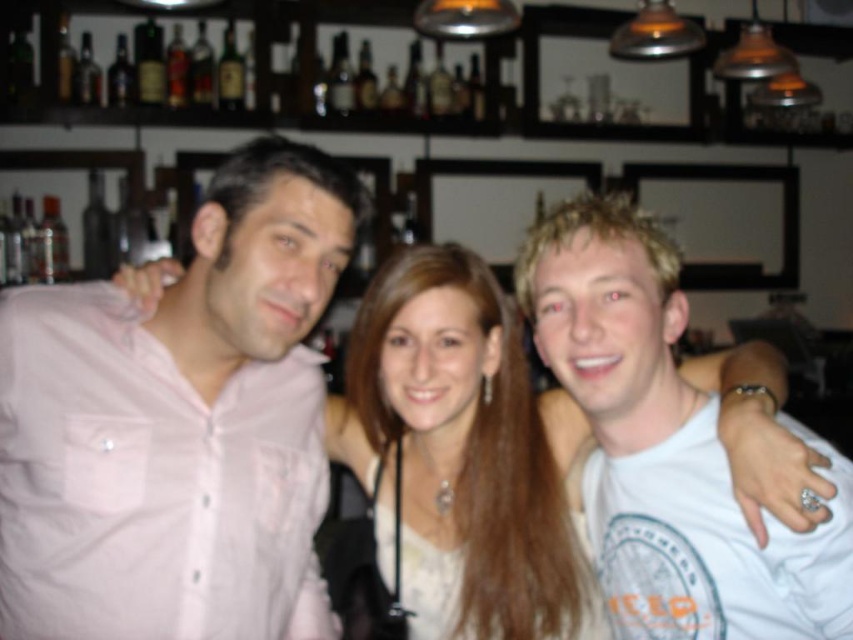
You are a photographer trying to capture a candid shot of the three people in the bar scene. You notice a white cotton t shirt at center located at point [666,445]. If you want to focus on the person wearing the white cotton t shirt at center, which direction should you move your camera to ensure they are centered in your viewfinder?

The white cotton t shirt at center is already at the center point [666,445], so no adjustment is needed. The camera should already have the person wearing the white cotton t shirt at center in the center of the viewfinder.

You are taking a photo of three friends at a bar. You notice two points in the image labeled as point 1 and point 2. Point 1 is at coordinates (807, 625) and point 2 is at (505, 381). Based on their positions in the image, which point is closer to the camera?

Point 1 is closer to the camera than point 2 because the description states that point 1 is closer than point 2.